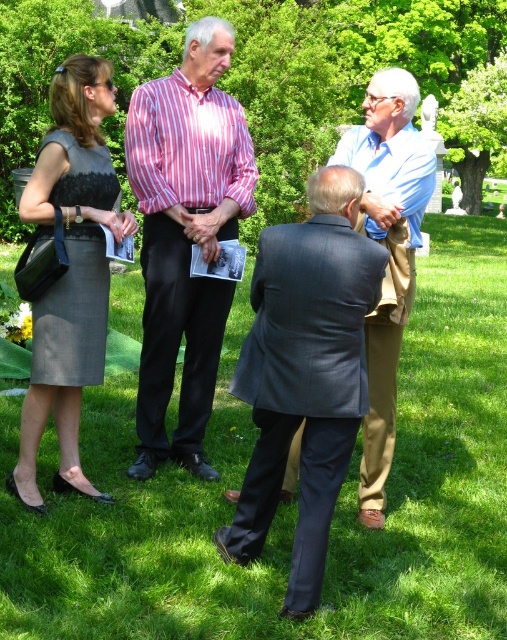
Based on the scene description, which object is taller between the dark gray suit at center and the light blue shirt at center?

The dark gray suit at center is much taller than the light blue shirt at center.

What is the spatial relationship between the dark gray suit at center and the other objects in the scene?

The dark gray suit at center is positioned at coordinates point (305, 372), but without additional object descriptions, I cannot specify its relation to others.

You are a photographer trying to capture a group photo of the dark gray suit at center and the matte gray dress at left. The camera you are using has a maximum focus range of 4 feet. Can you take a photo of both subjects without moving either of them?

The distance between the dark gray suit at center and the matte gray dress at left is 4.49 feet. Since the camera can only focus within 4 feet, the subjects are slightly out of range. You would need to move them closer or use a different camera with a longer focus range.